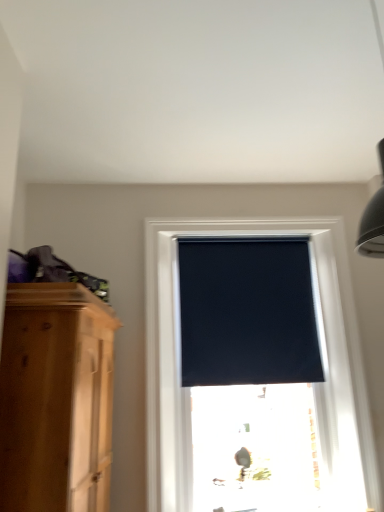
Question: Would you say black matte window at center is inside or outside black matte window blind at center?

Choices:
 (A) outside
 (B) inside

Answer: (A)

Question: In terms of height, does black matte window at center look taller or shorter compared to black matte window blind at center?

Choices:
 (A) short
 (B) tall

Answer: (B)

Question: In terms of width, does black matte window at center look wider or thinner when compared to black matte window blind at center?

Choices:
 (A) thin
 (B) wide

Answer: (B)

Question: Is black matte window blind at center wider or thinner than black matte window at center?

Choices:
 (A) wide
 (B) thin

Answer: (B)

Question: From a real-world perspective, is black matte window blind at center above or below black matte window at center?

Choices:
 (A) below
 (B) above

Answer: (B)

Question: In the image, is black matte window blind at center positioned in front of or behind black matte window at center?

Choices:
 (A) behind
 (B) front

Answer: (A)

Question: Based on their positions, is black matte window blind at center located to the left or right of black matte window at center?

Choices:
 (A) right
 (B) left

Answer: (B)